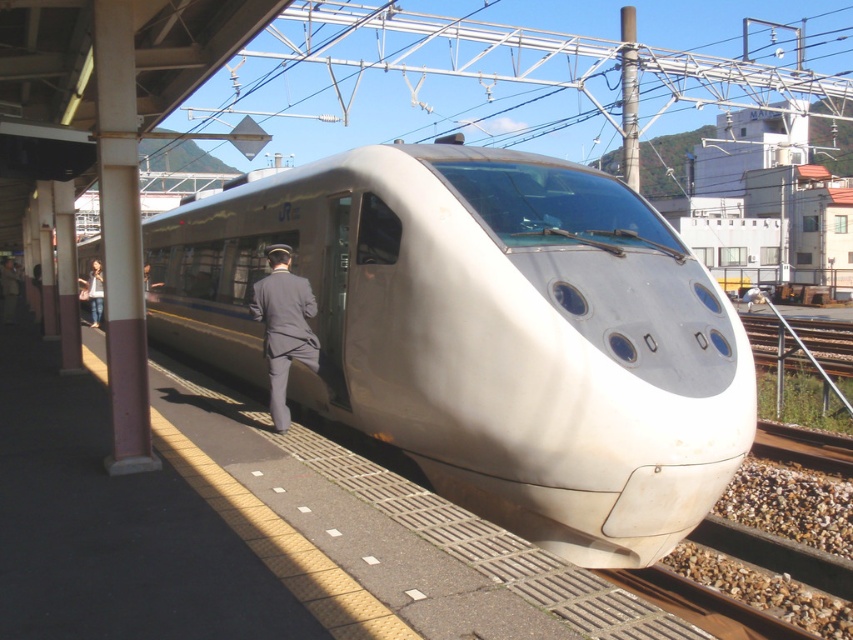
You are standing on the platform and want to board the train. Which object, the white glossy train at center or the dark gray uniform at center, is closer to you as you approach the entrance?

The white glossy train at center is closer to the viewer than the dark gray uniform at center, so you should head towards the white glossy train at center first.

Consider the image. You are standing at the camera position and want to reach the point marked as point (332, 195) on the platform. Can you estimate how far you need to walk to get there?

The point (332, 195) is 7.56 meters away from the camera, so you need to walk approximately 7.56 meters to reach it.

You are standing on the platform of the modern bullet train station. You see two points marked on the ground. The first point is at coordinate point (491, 179) and the second is at coordinate point (96, 284). If you face the direction the train is heading, which point is closer to the front of the train?

Point (491, 179) is in front of point (96, 284), so the first point is closer to the front of the train.